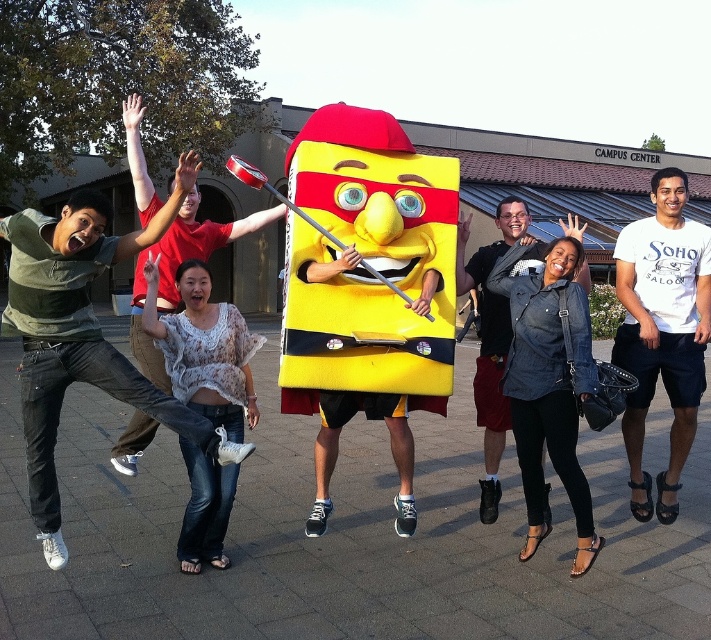
Question: Which of these objects is positioned closest to the white cotton t-shirt at center?

Choices:
 (A) yellow matte costume at center
 (B) denim jacket at center

Answer: (B)

Question: Observing the image, what is the correct spatial positioning of white cotton t-shirt at center in reference to denim jacket at center?

Choices:
 (A) right
 (B) left

Answer: (A)

Question: Which of the following is the closest to the observer?

Choices:
 (A) white cotton t-shirt at center
 (B) denim jacket at center

Answer: (A)

Question: Is white cotton t-shirt at center behind yellow matte costume at center?

Choices:
 (A) yes
 (B) no

Answer: (B)

Question: Based on their relative distances, which object is nearer to the denim jacket at center?

Choices:
 (A) yellow matte costume at center
 (B) white cotton t-shirt at center

Answer: (A)

Question: Does white cotton t-shirt at center have a greater width compared to denim jacket at center?

Choices:
 (A) no
 (B) yes

Answer: (B)